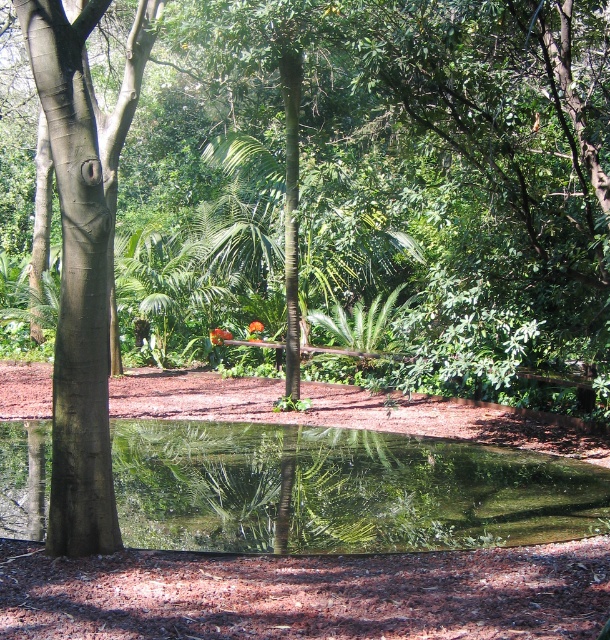
Question: Is transparent glass puddle at center closer to the viewer compared to smooth brown tree trunk at left?

Choices:
 (A) no
 (B) yes

Answer: (A)

Question: Which point appears farthest from the camera in this image?

Choices:
 (A) (70, 232)
 (B) (468, 461)

Answer: (B)

Question: Does transparent glass puddle at center appear on the left side of smooth brown tree trunk at left?

Choices:
 (A) yes
 (B) no

Answer: (B)

Question: Is transparent glass puddle at center bigger than smooth brown tree trunk at left?

Choices:
 (A) yes
 (B) no

Answer: (B)

Question: Which point is farther to the camera?

Choices:
 (A) smooth brown tree trunk at left
 (B) transparent glass puddle at center

Answer: (B)